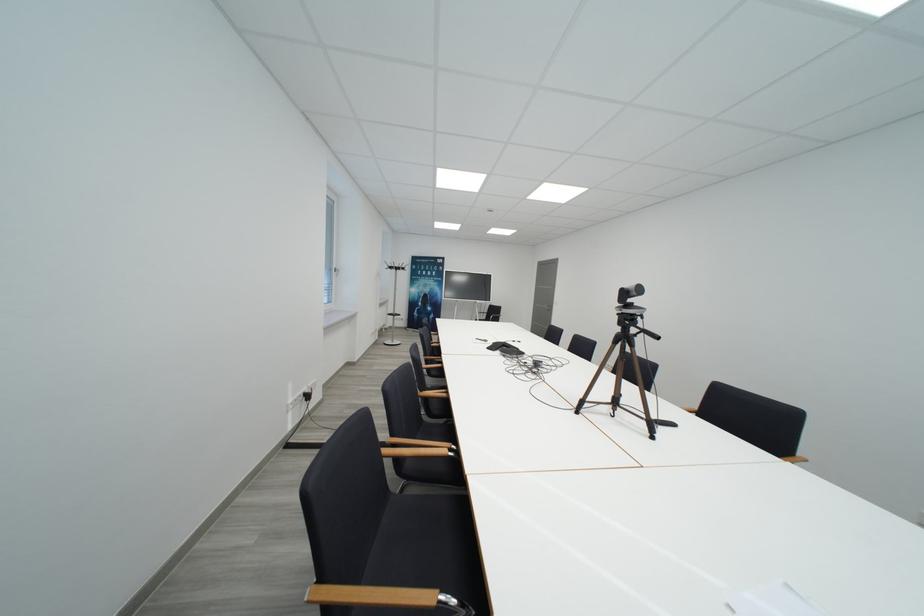
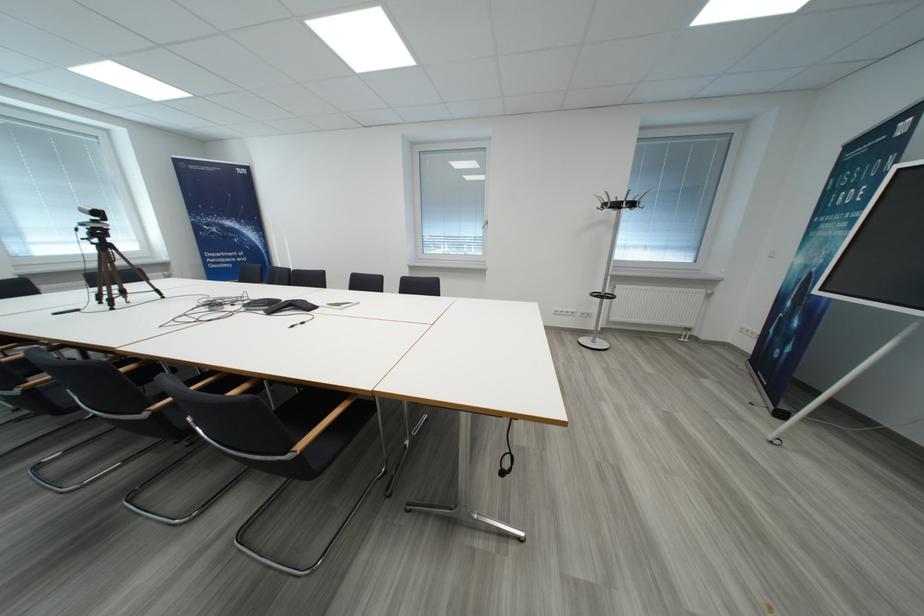
Locate, in the second image, the point that corresponds to the point at 421,293 in the first image.

(807, 264)